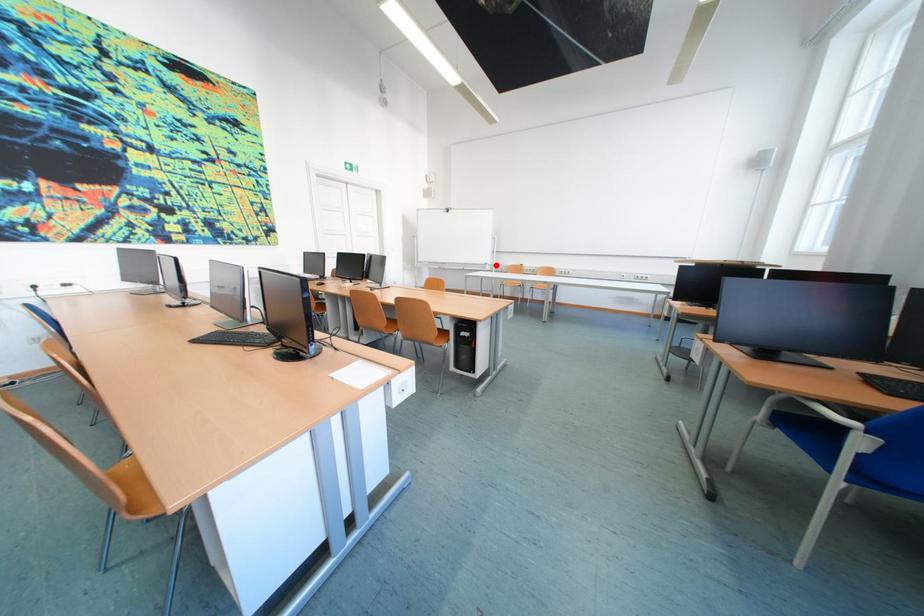
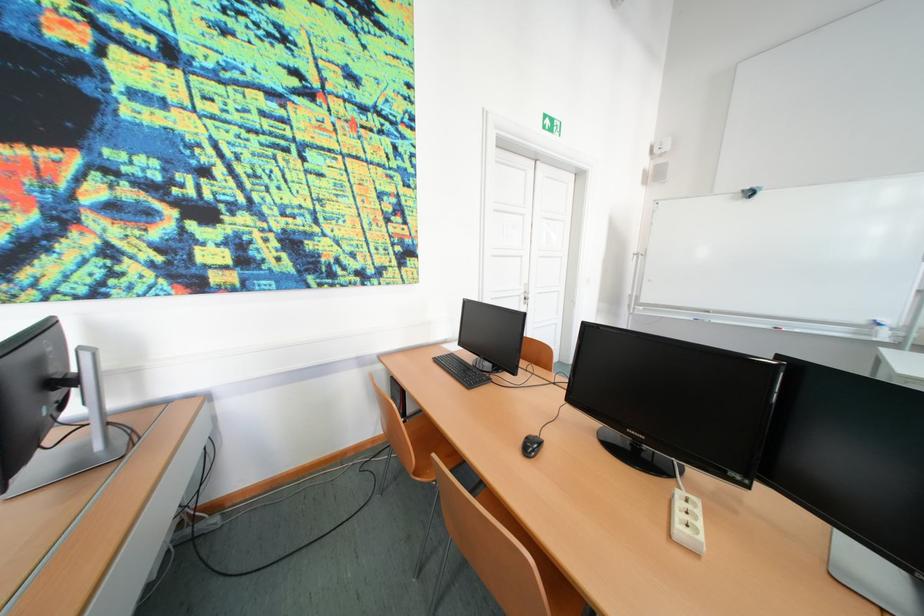
Question: I am providing you with two images of the same scene from different viewpoints. Image1 has a red point marked. In image2, the corresponding 3D location appears at what relative position? Reply with the corresponding letter.

Choices:
 (A) Closer
 (B) Farther

Answer: (B)